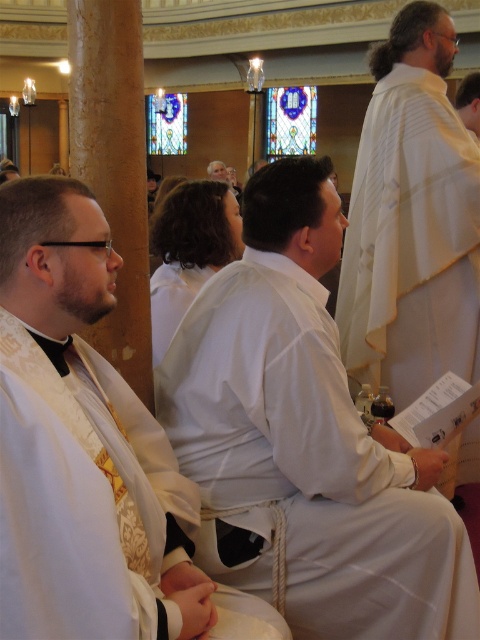
Question: Can you confirm if white matte/soft robe at center is positioned above white matte robe at center?

Choices:
 (A) yes
 (B) no

Answer: (B)

Question: Which of the following is the farthest from the observer?

Choices:
 (A) (260, 451)
 (B) (108, 541)
 (C) (169, 301)
 (D) (396, 184)

Answer: (C)

Question: Can you confirm if white satin robe at center is positioned above white matte robe at center?

Choices:
 (A) no
 (B) yes

Answer: (A)

Question: Which object is farther from the camera taking this photo?

Choices:
 (A) white matte robe at center
 (B) white satin robe at center

Answer: (A)

Question: Observing the image, what is the correct spatial positioning of white matte/soft robe at center in reference to white textured robe at center?

Choices:
 (A) above
 (B) below

Answer: (B)

Question: Which object appears closest to the camera in this image?

Choices:
 (A) white textured robe at center
 (B) white matte robe at center
 (C) white satin robe at center

Answer: (C)